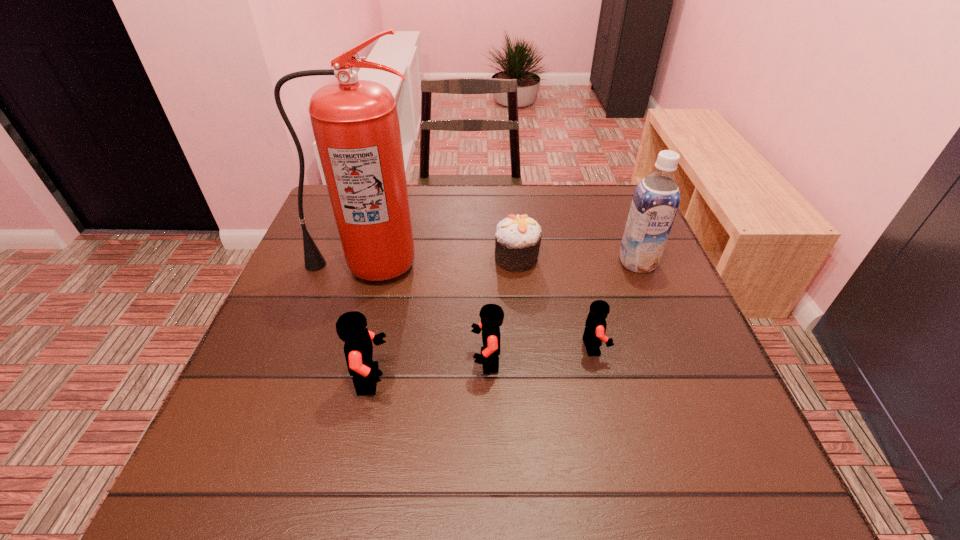
Where is `vacant space at the far edge of the desktop`? This screenshot has height=540, width=960. vacant space at the far edge of the desktop is located at coordinates (541, 219).

This screenshot has height=540, width=960. I want to click on vacant space at the near edge of the desktop, so click(x=541, y=395).

In the image, there is a desktop. Where is `vacant region at the left edge`? The width and height of the screenshot is (960, 540). vacant region at the left edge is located at coordinates coord(274,331).

Find the location of a particular element. vacant area at the right edge is located at coordinates (607, 256).

In the image, there is a desktop. Identify the location of free space at the near left corner. This screenshot has width=960, height=540. (311, 423).

Identify the location of free space at the far right corner of the desktop. Image resolution: width=960 pixels, height=540 pixels. (633, 197).

This screenshot has height=540, width=960. Identify the location of vacant space in between the cupcake and the fire extinguisher. (441, 261).

At what (x,y) coordinates should I click in order to perform the action: click on empty location between the tallest object and the third shortest object. Please return your answer as a coordinate pair (x, y). The height and width of the screenshot is (540, 960). Looking at the image, I should click on tap(426, 313).

At what (x,y) coordinates should I click in order to perform the action: click on vacant area that lies between the fire extinguisher and the cupcake. Please return your answer as a coordinate pair (x, y). The image size is (960, 540). Looking at the image, I should click on (441, 261).

Locate an element on the screen. free space between the fire extinguisher and the cupcake is located at coordinates (441, 261).